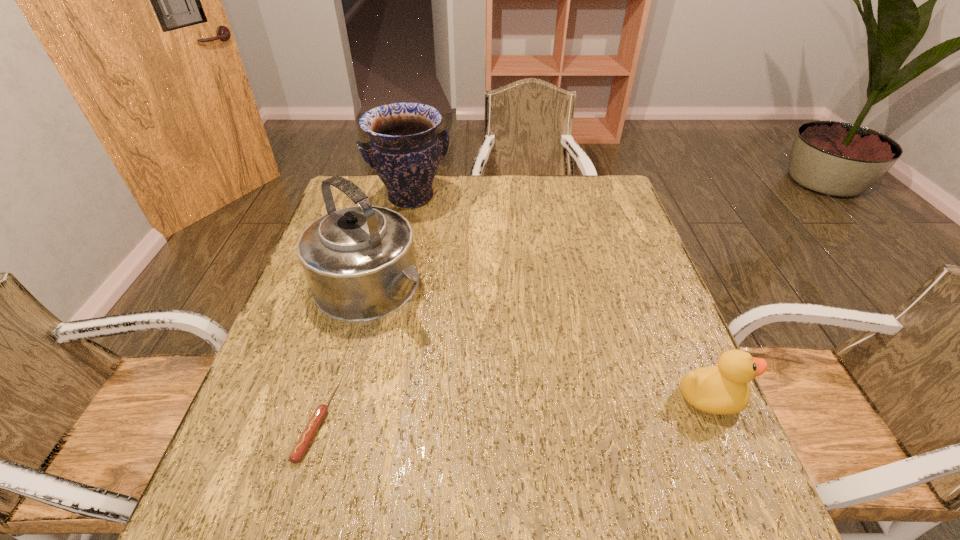
Where is `empty space between the duck and the pottery`? The width and height of the screenshot is (960, 540). empty space between the duck and the pottery is located at coordinates (560, 298).

You are a GUI agent. You are given a task and a screenshot of the screen. Output one action in this format:
    pyautogui.click(x=<x>, y=<y>)
    Task: Click on the free point between the kettle and the rightmost object
    The width and height of the screenshot is (960, 540).
    Given the screenshot: What is the action you would take?
    pyautogui.click(x=540, y=342)

Identify the location of empty location between the kettle and the shortest object. (345, 354).

Locate an element on the screen. unoccupied position between the third tallest object and the farthest object is located at coordinates (560, 298).

Select which object appears as the closest to the second farthest object. Please provide its 2D coordinates. Your answer should be formatted as a tuple, i.e. [(x, y)], where the tuple contains the x and y coordinates of a point satisfying the conditions above.

[(404, 150)]

Select which object is the second closest to the second farthest object. Please provide its 2D coordinates. Your answer should be formatted as a tuple, i.e. [(x, y)], where the tuple contains the x and y coordinates of a point satisfying the conditions above.

[(310, 430)]

The width and height of the screenshot is (960, 540). I want to click on free location that satisfies the following two spatial constraints: 1. on the back side of the pottery; 2. on the right side of the shortest object, so click(382, 198).

Where is `free location that satisfies the following two spatial constraints: 1. on the back side of the pottery; 2. on the left side of the third nearest object`? The width and height of the screenshot is (960, 540). free location that satisfies the following two spatial constraints: 1. on the back side of the pottery; 2. on the left side of the third nearest object is located at coordinates (395, 198).